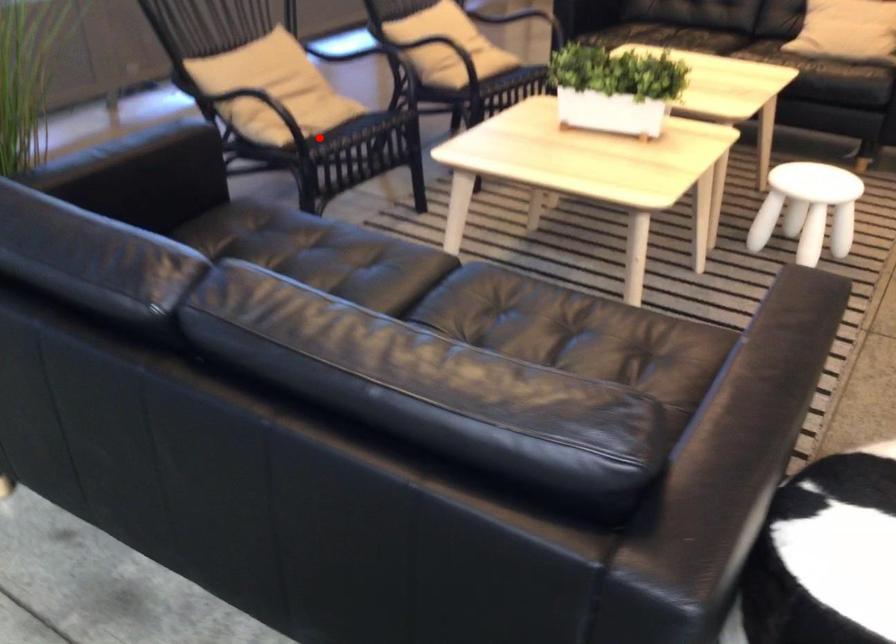
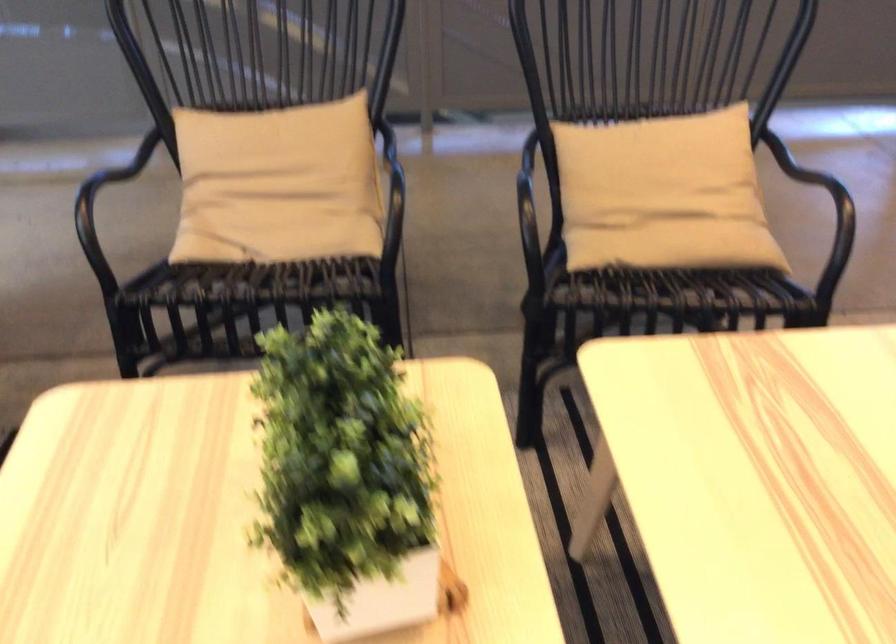
The point at the highlighted location is marked in the first image. Where is the corresponding point in the second image?

(268, 267)